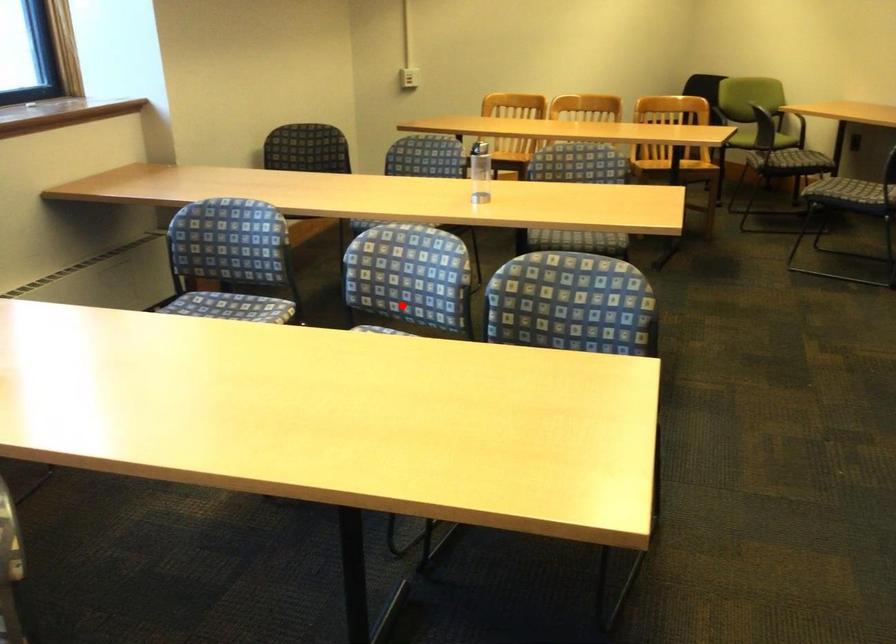
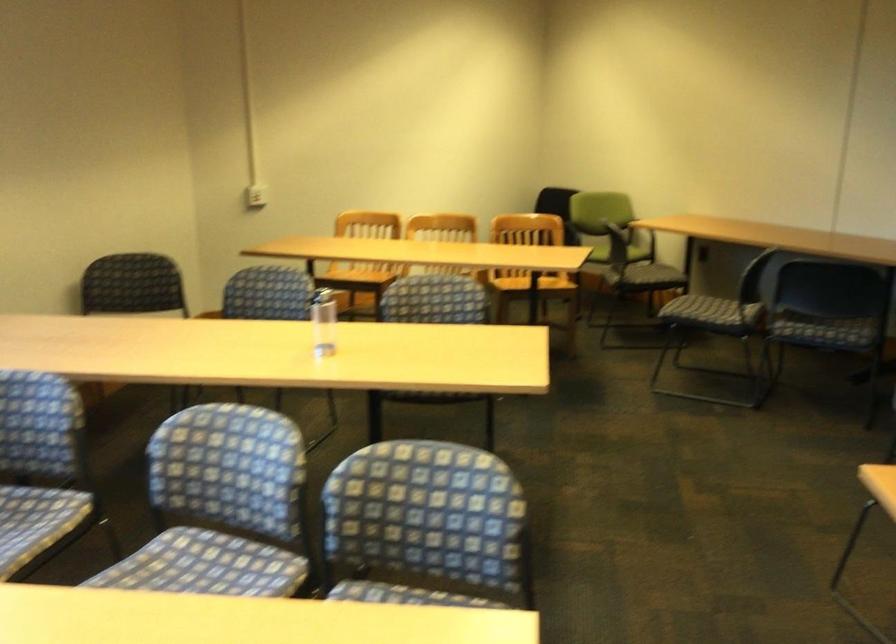
In the second image, find the point that corresponds to the highlighted location in the first image.

(221, 506)